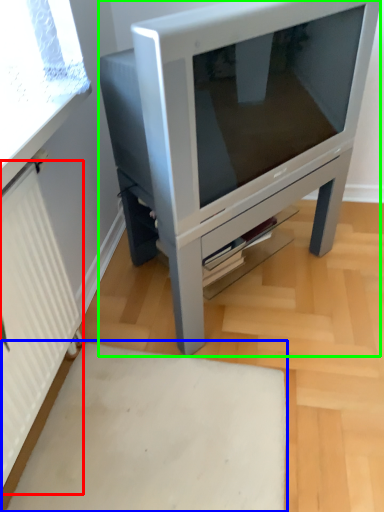
Question: Which is nearer to the radiator (highlighted by a red box)? plain (highlighted by a blue box) or furniture (highlighted by a green box).

Choices:
 (A) plain
 (B) furniture

Answer: (A)